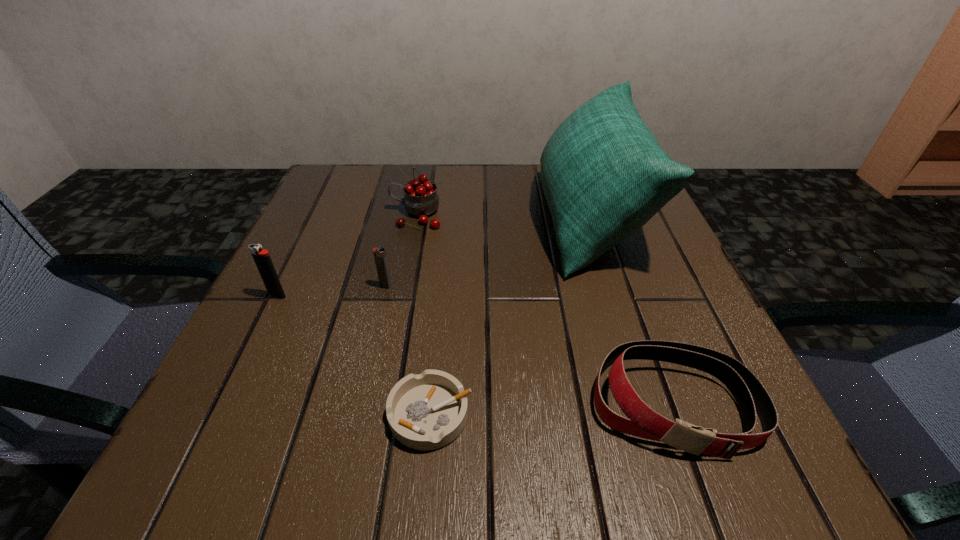
At what (x,y) coordinates should I click in order to perform the action: click on dog collar situated at the near edge. Please return your answer as a coordinate pair (x, y). This screenshot has width=960, height=540. Looking at the image, I should click on (750, 395).

Where is `ashtray at the near edge`? The image size is (960, 540). ashtray at the near edge is located at coordinates (427, 411).

I want to click on object situated at the left edge, so click(262, 259).

Locate an element on the screen. cushion that is at the right edge is located at coordinates (604, 175).

Where is `dog collar situated at the right edge`? This screenshot has width=960, height=540. dog collar situated at the right edge is located at coordinates (750, 395).

At what (x,y) coordinates should I click in order to perform the action: click on object situated at the far right corner. Please return your answer as a coordinate pair (x, y). The image size is (960, 540). Looking at the image, I should click on (604, 175).

Locate an element on the screen. object located in the near right corner section of the desktop is located at coordinates (x=750, y=395).

You are a GUI agent. You are given a task and a screenshot of the screen. Output one action in this format:
    pyautogui.click(x=<x>, y=<y>)
    Task: Click on the free space at the far edge of the desktop
    Image resolution: width=960 pixels, height=540 pixels.
    Given the screenshot: What is the action you would take?
    pyautogui.click(x=537, y=165)

Image resolution: width=960 pixels, height=540 pixels. In the image, there is a desktop. In order to click on vacant space at the near edge in this screenshot , I will do `click(625, 480)`.

In order to click on vacant area at the left edge in this screenshot , I will do `click(317, 294)`.